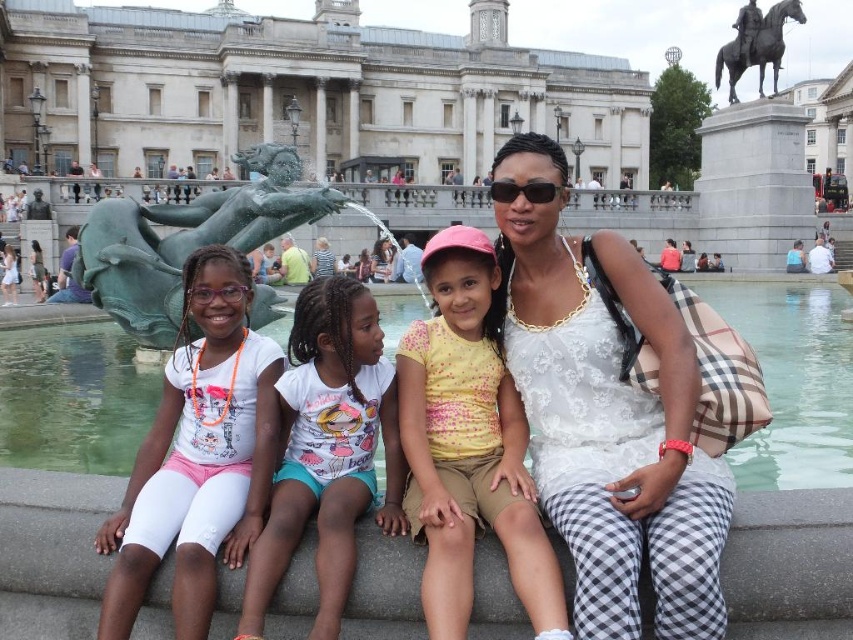
Measure the distance between point (115, 566) and camera.

Point (115, 566) and camera are 32.57 meters apart.

Does white matte t-shirt at center have a greater height compared to green patina bronze mermaid at center?

No, white matte t-shirt at center is not taller than green patina bronze mermaid at center.

What do you see at coordinates (198, 454) in the screenshot?
I see `white matte t-shirt at center` at bounding box center [198, 454].

Identify the location of white matte t-shirt at center. (198, 454).

Between white matte t-shirt at center and black polished metal horse at upper right, which one appears on the right side from the viewer's perspective?

black polished metal horse at upper right is more to the right.

Which of these two, white matte t-shirt at center or black polished metal horse at upper right, stands taller?

With more height is white matte t-shirt at center.

The width and height of the screenshot is (853, 640). Identify the location of white matte t-shirt at center. (198, 454).

Between yellow dotted shirt at center and black polished metal horse at upper right, which one appears on the left side from the viewer's perspective?

yellow dotted shirt at center is more to the left.

Is yellow dotted shirt at center to the right of black polished metal horse at upper right from the viewer's perspective?

No, yellow dotted shirt at center is not to the right of black polished metal horse at upper right.

Which is in front, point (521, 442) or point (776, 33)?

Point (521, 442)

At what (x,y) coordinates should I click in order to perform the action: click on yellow dotted shirt at center. Please return your answer as a coordinate pair (x, y). Looking at the image, I should click on (468, 445).